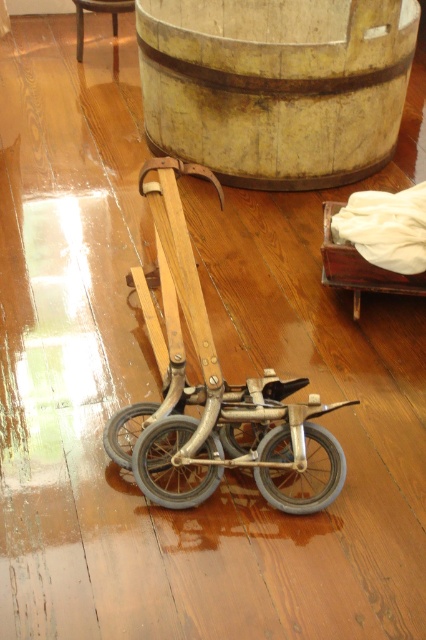
Question: Does wooden barrel at upper center lie behind metallic gray wheel at center?

Choices:
 (A) no
 (B) yes

Answer: (B)

Question: Can you confirm if gray rubber wheel at center is bigger than metallic silver wheel at lower center?

Choices:
 (A) no
 (B) yes

Answer: (B)

Question: Which point is closer to the camera?

Choices:
 (A) (135, 429)
 (B) (193, 499)
 (C) (296, 404)
 (D) (123, 1)

Answer: (B)

Question: Which is nearer to the gray rubber wheel at center?

Choices:
 (A) metallic silver tricycle at center
 (B) metallic silver wheel at lower center
 (C) metallic gray wheel at center

Answer: (B)

Question: Where is wooden barrel at upper center located in relation to gray rubber wheel at center in the image?

Choices:
 (A) right
 (B) left

Answer: (A)

Question: Among these points, which one is nearest to the camera?

Choices:
 (A) (132, 3)
 (B) (103, 444)
 (C) (215, 180)
 (D) (371, 24)

Answer: (C)